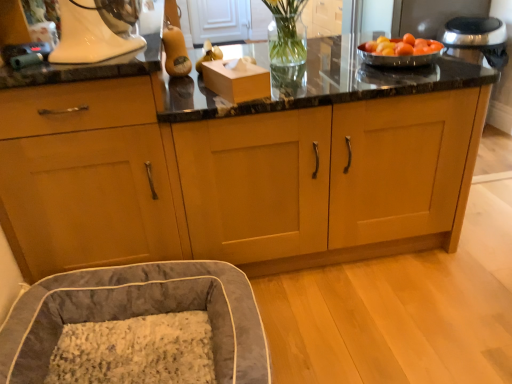
Where is `blank space situated above silver metallic bowl at upper right (from a real-world perspective)`? blank space situated above silver metallic bowl at upper right (from a real-world perspective) is located at coordinates (402, 48).